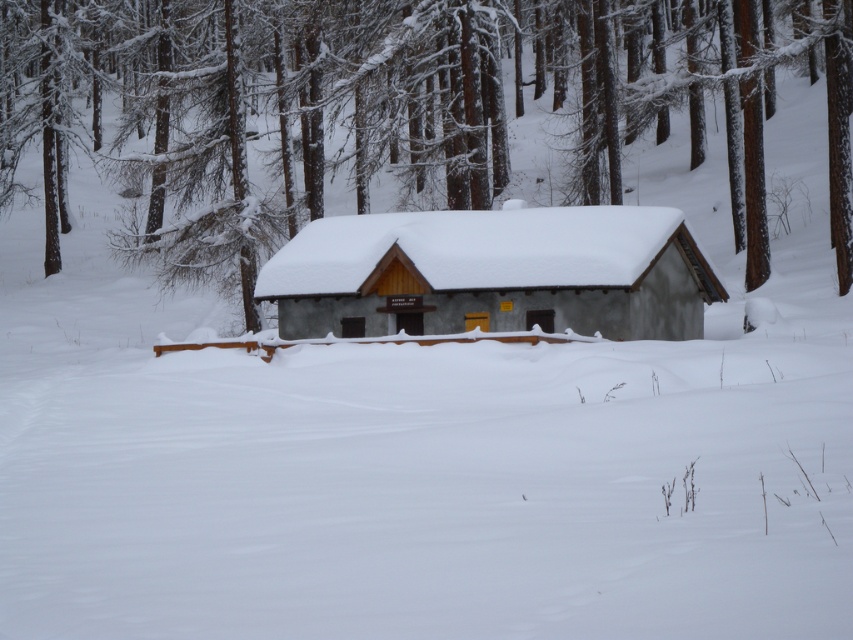
You are standing in the snowy forest and want to walk from the brown wood tree at center to the smooth gray cabin at center. Which direction should you face to walk directly towards the cabin?

You should face away from the brown wood tree at center towards the smooth gray cabin at center since the cabin is located at the center of the scene.

You are standing in front of the snowy cabin and notice two points marked on the ground. The first point is at coordinate point (181,196) and the second is at point (547,228). Which point is closer to you?

Point (181,196) is closer to you because it is further to the viewer than point (547,228).

You are planning to build a treehouse and need to know which structure is taller. Based on the scene, which is taller between the brown wood tree at center and the smooth gray cabin at center?

The brown wood tree at center is taller than the smooth gray cabin at center according to the description.